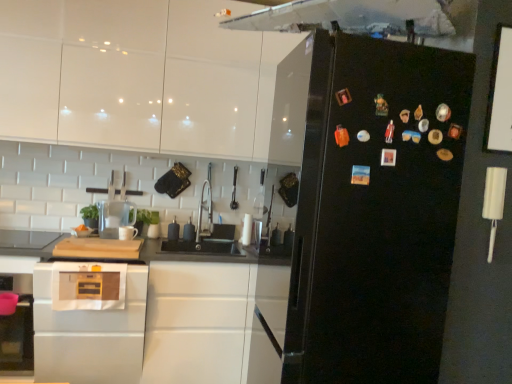
Question: From the image's perspective, is black glossy refrigerator at right below satin silver oven at lower left?

Choices:
 (A) yes
 (B) no

Answer: (B)

Question: Is black glossy refrigerator at right smaller than satin silver oven at lower left?

Choices:
 (A) yes
 (B) no

Answer: (B)

Question: Does black glossy refrigerator at right have a larger size compared to satin silver oven at lower left?

Choices:
 (A) yes
 (B) no

Answer: (A)

Question: Can you confirm if black glossy refrigerator at right is taller than satin silver oven at lower left?

Choices:
 (A) yes
 (B) no

Answer: (A)

Question: Does black glossy refrigerator at right appear on the left side of satin silver oven at lower left?

Choices:
 (A) no
 (B) yes

Answer: (A)

Question: From the image's perspective, relative to white glossy cabinets at upper center, which ranks as the 1th cabinetry in top-to-bottom order, is black glossy refrigerator at right above or below?

Choices:
 (A) above
 (B) below

Answer: (B)

Question: From their relative heights in the image, would you say black glossy refrigerator at right is taller or shorter than white glossy cabinets at upper center, which ranks as the 1th cabinetry in top-to-bottom order?

Choices:
 (A) tall
 (B) short

Answer: (A)

Question: Is black glossy refrigerator at right inside or outside of white glossy cabinets at upper center, marked as the second cabinetry in a bottom-to-top arrangement?

Choices:
 (A) outside
 (B) inside

Answer: (A)

Question: Visually, is black glossy refrigerator at right positioned to the left or to the right of white glossy cabinets at upper center, marked as the second cabinetry in a bottom-to-top arrangement?

Choices:
 (A) left
 (B) right

Answer: (B)

Question: From a real-world perspective, is white glossy cabinet at lower left, the second cabinetry viewed from the top, positioned above or below black glossy refrigerator at right?

Choices:
 (A) below
 (B) above

Answer: (A)

Question: Considering the positions of white glossy cabinet at lower left, the second cabinetry viewed from the top, and black glossy refrigerator at right in the image, is white glossy cabinet at lower left, the second cabinetry viewed from the top, wider or thinner than black glossy refrigerator at right?

Choices:
 (A) thin
 (B) wide

Answer: (A)

Question: Based on their sizes in the image, would you say white glossy cabinet at lower left, the second cabinetry viewed from the top, is bigger or smaller than black glossy refrigerator at right?

Choices:
 (A) small
 (B) big

Answer: (B)

Question: From the image's perspective, is white glossy cabinet at lower left, placed as the 1th cabinetry when sorted from bottom to top, located above or below black glossy refrigerator at right?

Choices:
 (A) above
 (B) below

Answer: (B)

Question: Considering the positions of point (211, 142) and point (404, 43), is point (211, 142) closer or farther from the camera than point (404, 43)?

Choices:
 (A) closer
 (B) farther

Answer: (B)

Question: Is white glossy cabinets at upper center, which ranks as the 1th cabinetry in top-to-bottom order, inside or outside of black glossy refrigerator at right?

Choices:
 (A) outside
 (B) inside

Answer: (A)